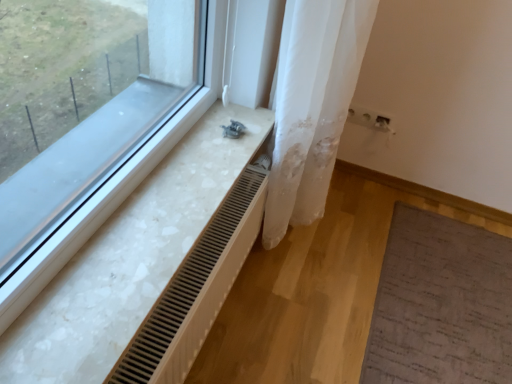
Question: From the image's perspective, does wooden radiator at lower left appear lower than white marble radiator at lower left?

Choices:
 (A) no
 (B) yes

Answer: (B)

Question: Is wooden radiator at lower left wider than white marble radiator at lower left?

Choices:
 (A) no
 (B) yes

Answer: (A)

Question: Is wooden radiator at lower left in front of white marble radiator at lower left?

Choices:
 (A) yes
 (B) no

Answer: (B)

Question: Can you confirm if wooden radiator at lower left is taller than white marble radiator at lower left?

Choices:
 (A) no
 (B) yes

Answer: (B)

Question: Is wooden radiator at lower left with white marble radiator at lower left?

Choices:
 (A) no
 (B) yes

Answer: (A)

Question: Is white marble radiator at lower left inside or outside of wooden radiator at lower left?

Choices:
 (A) outside
 (B) inside

Answer: (A)

Question: Considering the positions of white marble radiator at lower left and wooden radiator at lower left in the image, is white marble radiator at lower left bigger or smaller than wooden radiator at lower left?

Choices:
 (A) big
 (B) small

Answer: (B)

Question: From the image's perspective, is white marble radiator at lower left located above or below wooden radiator at lower left?

Choices:
 (A) below
 (B) above

Answer: (B)

Question: In terms of width, does white marble radiator at lower left look wider or thinner when compared to wooden radiator at lower left?

Choices:
 (A) wide
 (B) thin

Answer: (A)

Question: Is point (286, 208) positioned closer to the camera than point (37, 130)?

Choices:
 (A) farther
 (B) closer

Answer: (B)

Question: Based on their sizes in the image, would you say white sheer fabric at center is bigger or smaller than white marble radiator at lower left?

Choices:
 (A) big
 (B) small

Answer: (A)

Question: From a real-world perspective, is white sheer fabric at center positioned above or below white marble radiator at lower left?

Choices:
 (A) above
 (B) below

Answer: (B)

Question: Looking at their shapes, would you say white sheer fabric at center is wider or thinner than white marble radiator at lower left?

Choices:
 (A) thin
 (B) wide

Answer: (A)

Question: Is point (240, 196) positioned closer to the camera than point (267, 190)?

Choices:
 (A) farther
 (B) closer

Answer: (B)

Question: Is wooden radiator at lower left situated inside white sheer fabric at center or outside?

Choices:
 (A) inside
 (B) outside

Answer: (B)